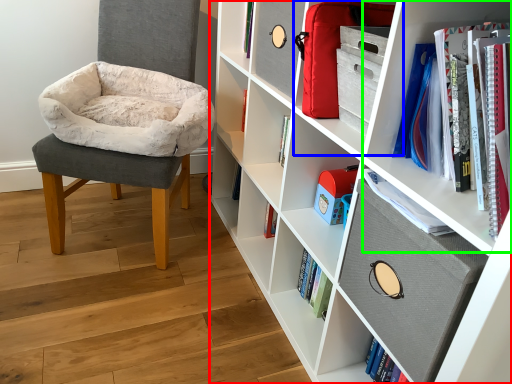
Question: Estimate the real-world distances between objects in this image. Which object is closer to shelf (highlighted by a red box), cabinet (highlighted by a blue box) or shelf (highlighted by a green box)?

Choices:
 (A) cabinet
 (B) shelf

Answer: (A)